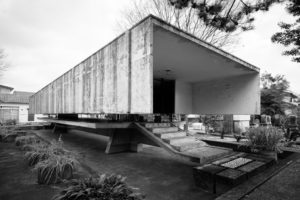
In order to click on ceiling of trailer in this screenshot , I will do `click(194, 65)`.